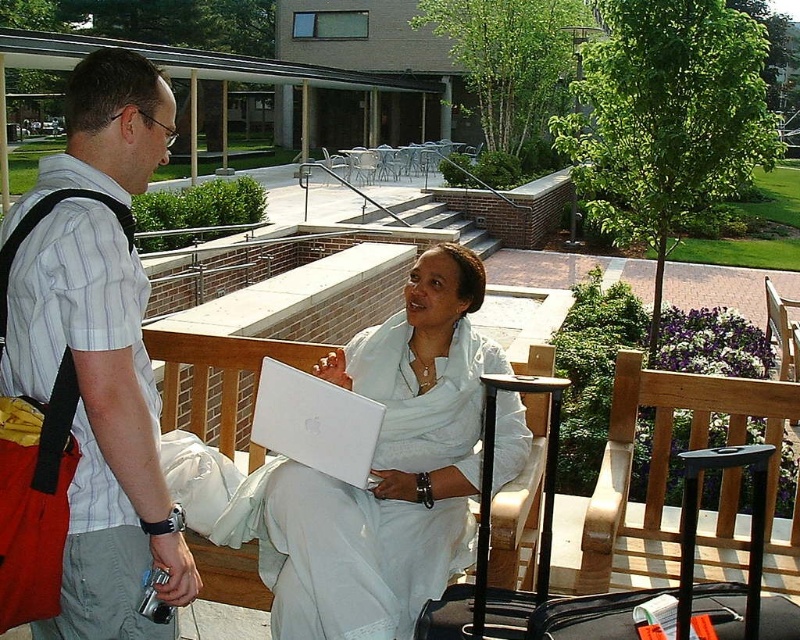
Question: Which object is positioned farthest from the black suitcase at lower right?

Choices:
 (A) black hard suitcase at center
 (B) white matte laptop at center

Answer: (B)

Question: Is the position of matte black shirt at left less distant than that of white matte laptop at center?

Choices:
 (A) yes
 (B) no

Answer: (A)

Question: Estimate the real-world distances between objects in this image. Which object is closer to the black suitcase at lower right?

Choices:
 (A) black hard suitcase at center
 (B) white matte laptop at center
 (C) matte black shirt at left

Answer: (A)

Question: Can you confirm if black suitcase at lower right is positioned above black hard suitcase at center?

Choices:
 (A) no
 (B) yes

Answer: (A)

Question: Estimate the real-world distances between objects in this image. Which object is farther from the matte black shirt at left?

Choices:
 (A) black hard suitcase at center
 (B) white matte laptop at center

Answer: (A)

Question: In this image, where is light brown wooden park bench at center located relative to black suitcase at lower right?

Choices:
 (A) right
 (B) left

Answer: (A)